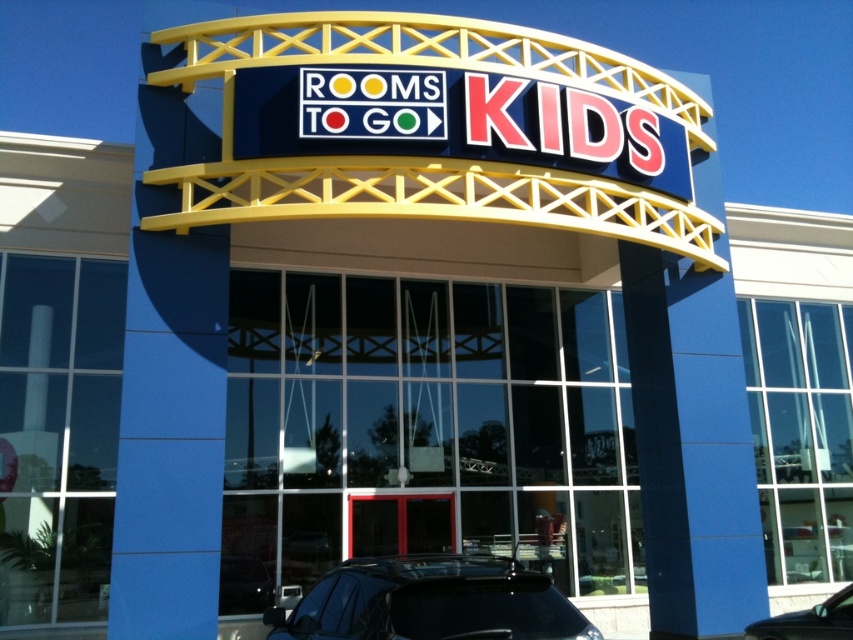
Can you confirm if metallic glass door at center is positioned below shiny black car at lower right?

Correct, metallic glass door at center is located below shiny black car at lower right.

Measure the distance between point (409, 502) and camera.

Point (409, 502) and camera are 10.44 meters apart.

The height and width of the screenshot is (640, 853). Find the location of `metallic glass door at center`. metallic glass door at center is located at coordinates (399, 524).

Can you confirm if black matte car at lower center is taller than metallic glass door at center?

Correct, black matte car at lower center is much taller as metallic glass door at center.

Which of these two, black matte car at lower center or metallic glass door at center, stands taller?

With more height is black matte car at lower center.

Image resolution: width=853 pixels, height=640 pixels. I want to click on black matte car at lower center, so click(431, 602).

Who is more distant from viewer, [404,556] or [837,598]?

Positioned behind is point [404,556].

Describe the element at coordinates (431, 602) in the screenshot. I see `black matte car at lower center` at that location.

Does point (409, 624) come in front of point (746, 627)?

Yes, point (409, 624) is in front of point (746, 627).

Where is `black matte car at lower center`? black matte car at lower center is located at coordinates (431, 602).